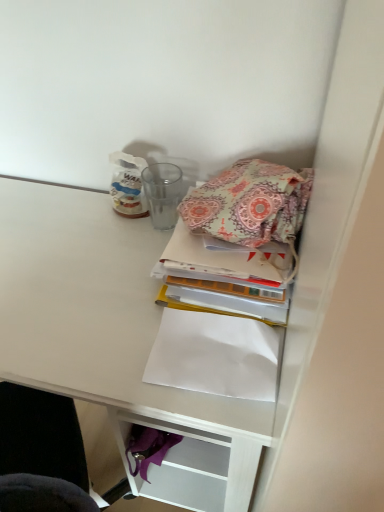
Question: Is white paper at lower center oriented away from patterned fabric bag at upper right?

Choices:
 (A) no
 (B) yes

Answer: (A)

Question: Is white paper at lower center with patterned fabric bag at upper right?

Choices:
 (A) no
 (B) yes

Answer: (A)

Question: Considering the relative sizes of white paper at lower center and patterned fabric bag at upper right in the image provided, is white paper at lower center smaller than patterned fabric bag at upper right?

Choices:
 (A) yes
 (B) no

Answer: (A)

Question: Does white paper at lower center have a greater height compared to patterned fabric bag at upper right?

Choices:
 (A) no
 (B) yes

Answer: (A)

Question: Is white paper at lower center bigger than patterned fabric bag at upper right?

Choices:
 (A) no
 (B) yes

Answer: (A)

Question: From the image's perspective, is white paper at lower center below patterned fabric bag at upper right?

Choices:
 (A) yes
 (B) no

Answer: (A)

Question: Can you confirm if white paper at lower center is positioned to the left of paisley fabric book at center?

Choices:
 (A) no
 (B) yes

Answer: (B)

Question: Considering the relative sizes of white paper at lower center and paisley fabric book at center in the image provided, is white paper at lower center wider than paisley fabric book at center?

Choices:
 (A) no
 (B) yes

Answer: (A)

Question: Does white paper at lower center have a smaller size compared to paisley fabric book at center?

Choices:
 (A) no
 (B) yes

Answer: (B)

Question: Considering the relative sizes of white paper at lower center and paisley fabric book at center in the image provided, is white paper at lower center thinner than paisley fabric book at center?

Choices:
 (A) yes
 (B) no

Answer: (A)

Question: Considering the relative sizes of white paper at lower center and paisley fabric book at center in the image provided, is white paper at lower center taller than paisley fabric book at center?

Choices:
 (A) yes
 (B) no

Answer: (B)

Question: Is white paper at lower center not within paisley fabric book at center?

Choices:
 (A) yes
 (B) no

Answer: (A)

Question: Is white matte desk at upper right thinner than paisley fabric book at center?

Choices:
 (A) yes
 (B) no

Answer: (B)